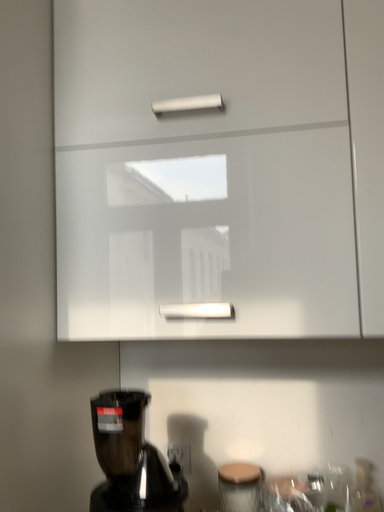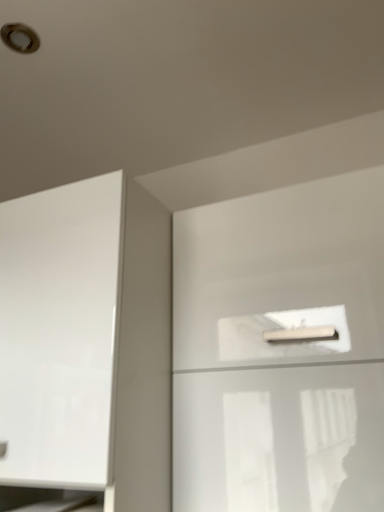
Question: How did the camera likely rotate when shooting the video?

Choices:
 (A) rotated left
 (B) rotated right

Answer: (A)